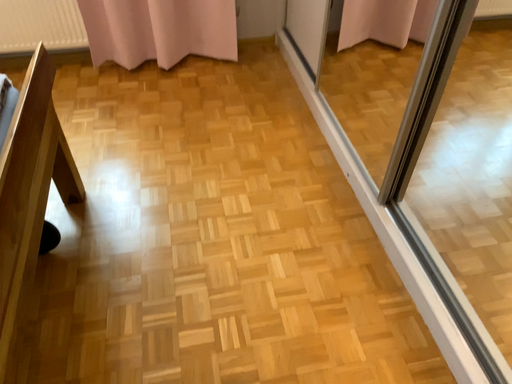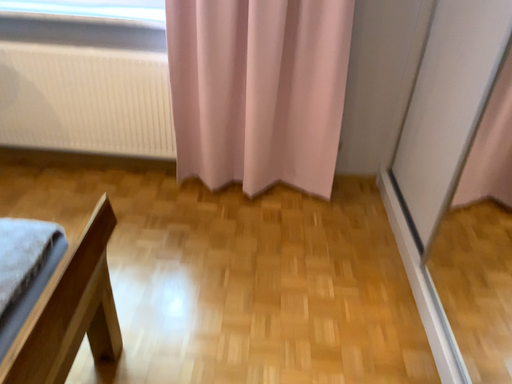
Question: Which way did the camera rotate in the video?

Choices:
 (A) rotated left
 (B) rotated right

Answer: (A)